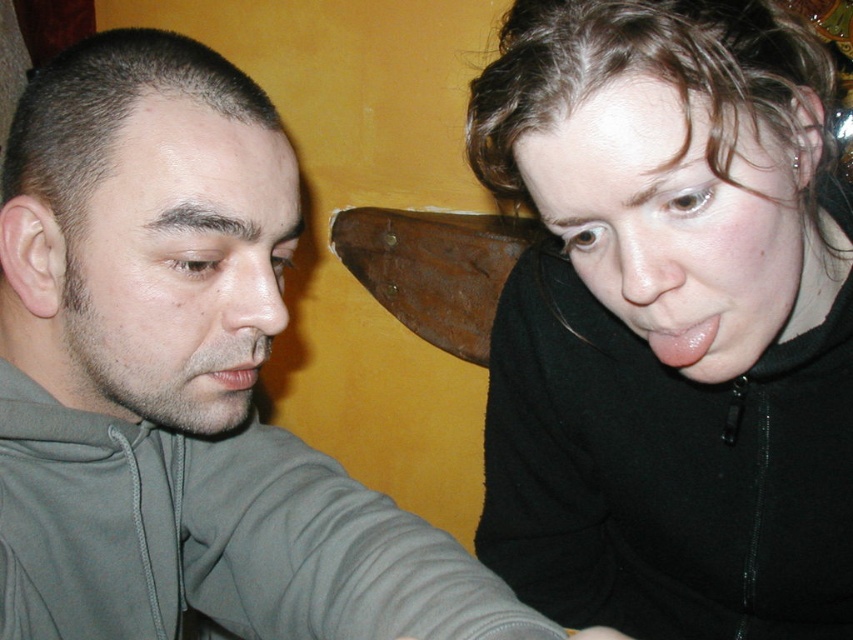
Can you confirm if gray fleece sweatshirt at left is wider than glossy pink tongue at upper right?

Correct, the width of gray fleece sweatshirt at left exceeds that of glossy pink tongue at upper right.

Which is above, gray fleece sweatshirt at left or glossy pink tongue at upper right?

glossy pink tongue at upper right is higher up.

This screenshot has height=640, width=853. I want to click on gray fleece sweatshirt at left, so click(x=216, y=538).

Is black fleece jacket at upper right shorter than gray fleece sweatshirt at left?

In fact, black fleece jacket at upper right may be taller than gray fleece sweatshirt at left.

Which is behind, point (689, 4) or point (274, 541)?

Positioned behind is point (274, 541).

Find the location of `black fleece jacket at upper right`. black fleece jacket at upper right is located at coordinates (669, 321).

Is gray fleece sweatshirt at left below matte gray mouth at lower left?

Indeed, gray fleece sweatshirt at left is positioned under matte gray mouth at lower left.

I want to click on gray fleece sweatshirt at left, so click(x=216, y=538).